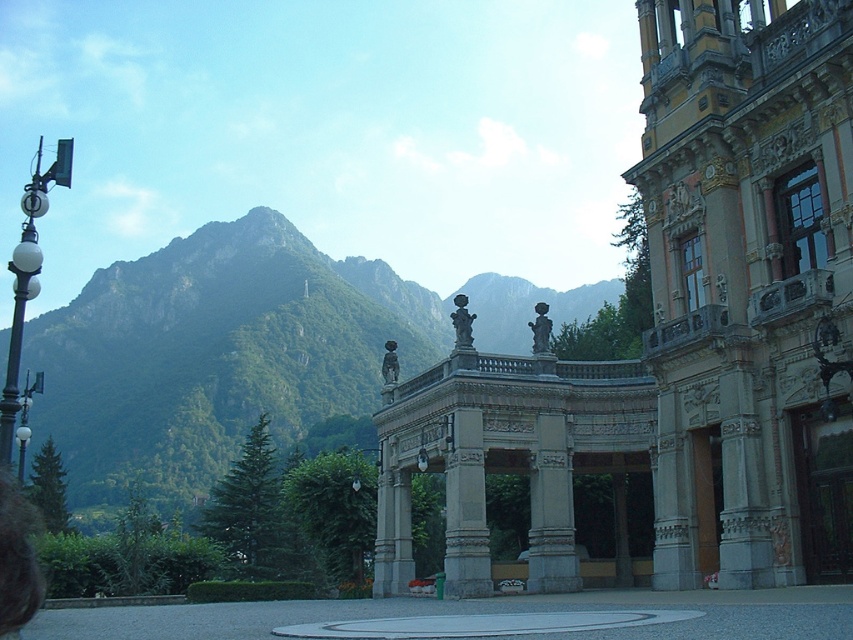
You are a tourist standing in front of the grand building on the right. You want to take a photo that includes both the green rocky mountain at upper left and the matte gray statue at center. Which object will appear larger in your photo?

The green rocky mountain at upper left will appear larger in the photo because it is closer to the viewer than the matte gray statue at center.

You are standing at the grand building on the right and want to walk towards the stone pavilion in the center. There are two points marked on the path. Which point, point 1 at coordinates (816, 556) or point 2 at coordinates (538, 316), is closer to your current position?

Point 1 at coordinates (816, 556) is closer to your current position as it is in front of point 2 at coordinates (538, 316).